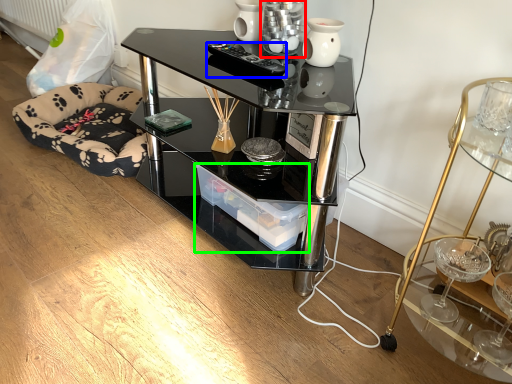
Question: Estimate the real-world distances between objects in this image. Which object is farther from candle holder (highlighted by a red box), remote control (highlighted by a blue box) or glass box (highlighted by a green box)?

Choices:
 (A) remote control
 (B) glass box

Answer: (B)